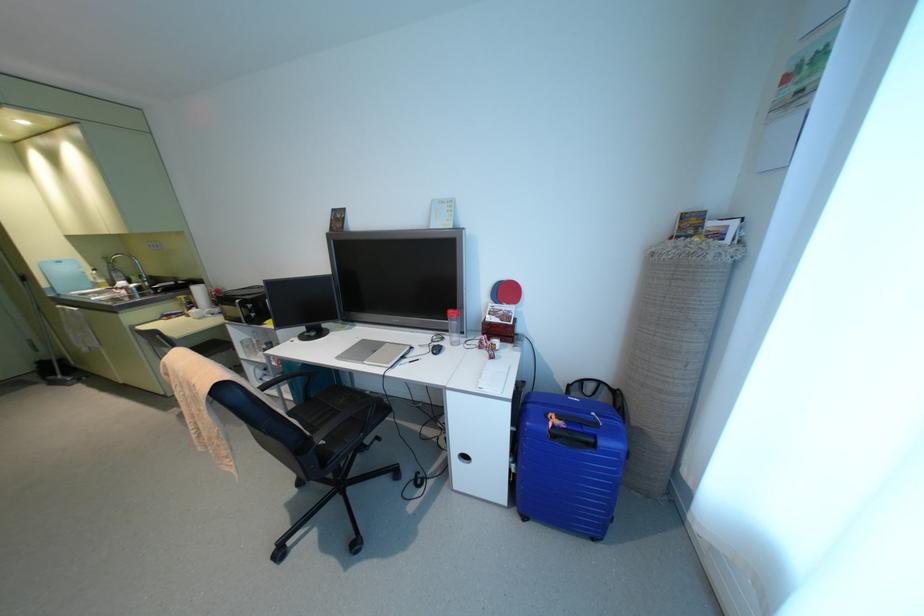
What do you see at coordinates (568, 430) in the screenshot? I see `the blue suitcase handle` at bounding box center [568, 430].